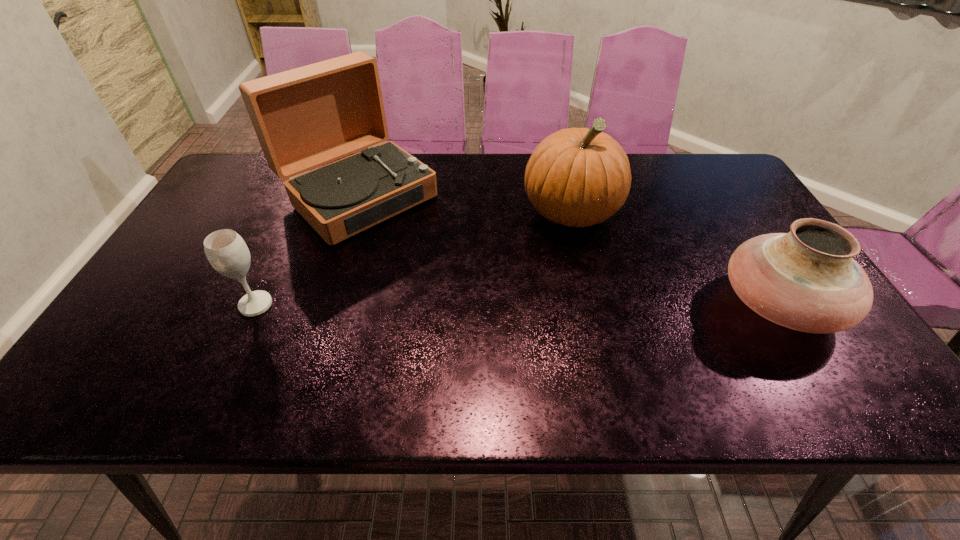
Image resolution: width=960 pixels, height=540 pixels. Find the location of `vacant spot on the desktop that is between the wineglass and the pottery and is positioned on the stem of the second object from right to left`. vacant spot on the desktop that is between the wineglass and the pottery and is positioned on the stem of the second object from right to left is located at coordinates (556, 305).

The image size is (960, 540). I want to click on free space on the desktop that is between the wineglass and the rightmost object and is positioned on the face of the phonograph record, so click(x=481, y=305).